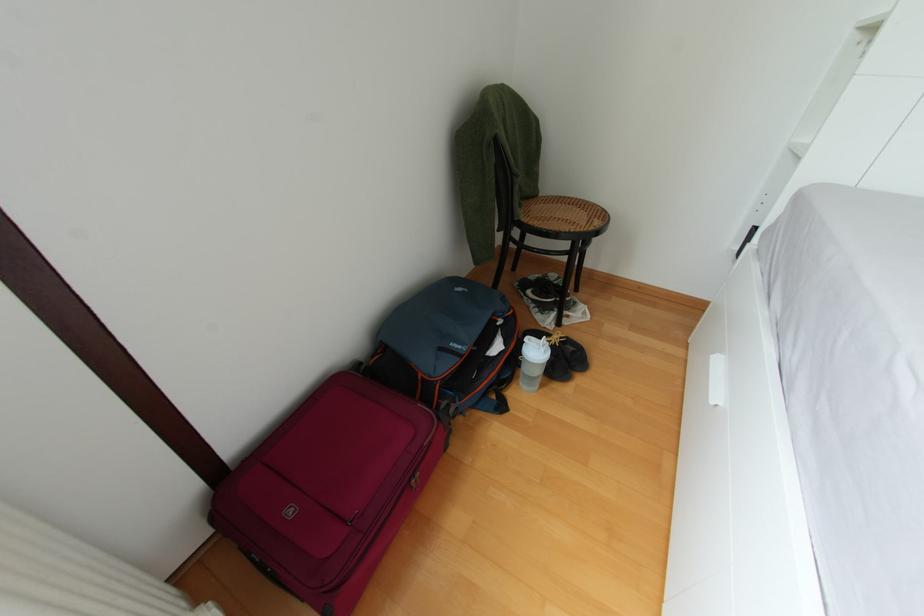
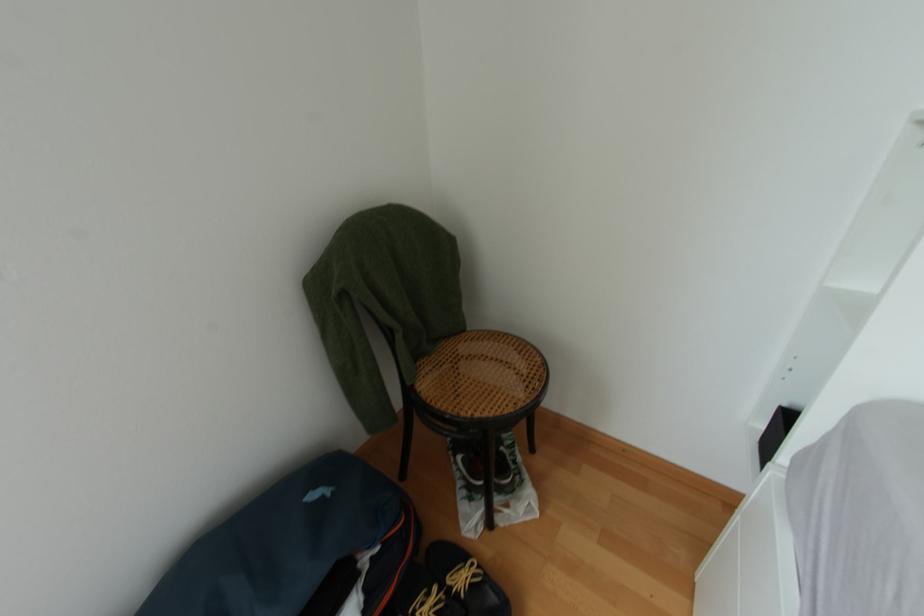
Question: Based on the continuous images, in which direction is the camera rotating? Reply with the corresponding letter.

Choices:
 (A) Left
 (B) Right
 (C) Up
 (D) Down

Answer: (C)